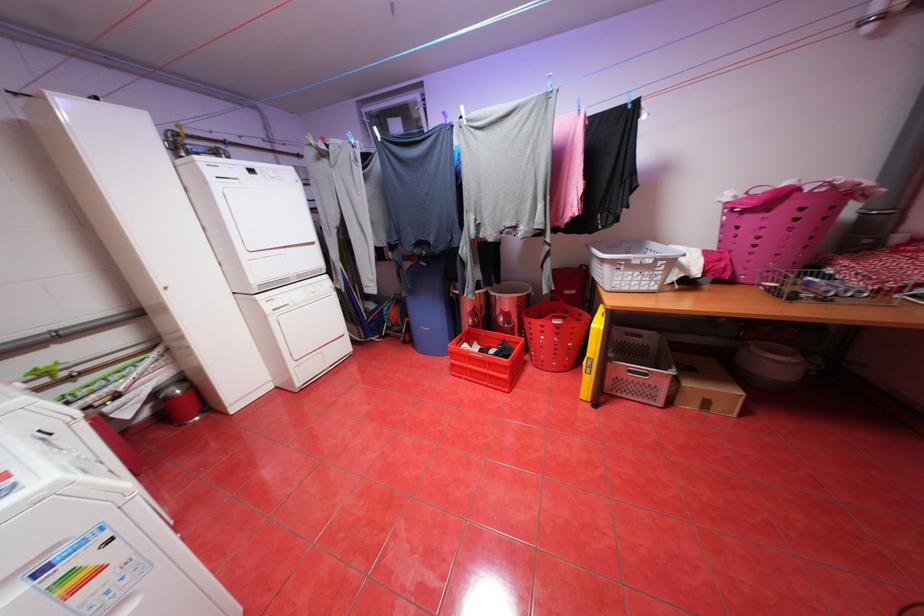
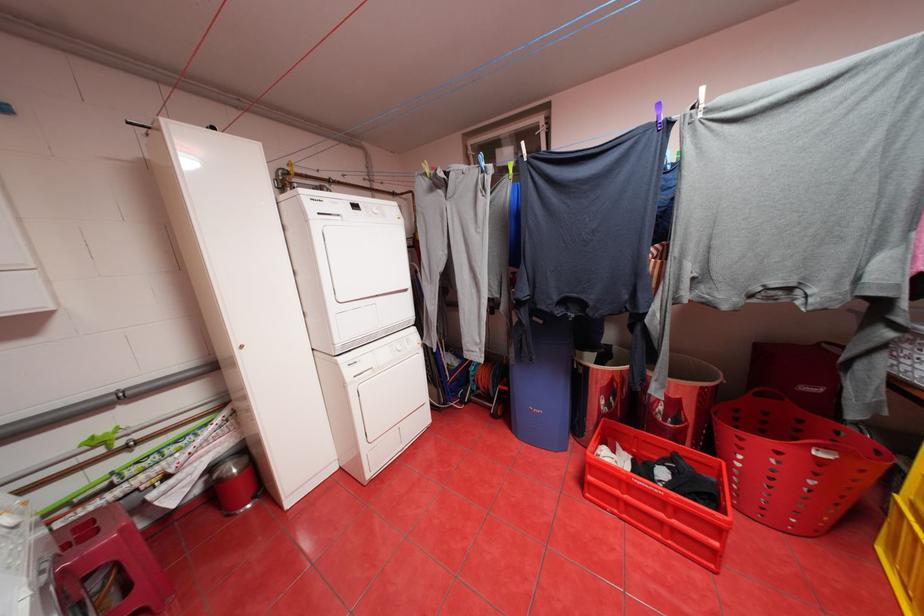
Question: The first image is from the beginning of the video and the second image is from the end. How did the camera likely rotate when shooting the video?

Choices:
 (A) Left
 (B) Right
 (C) Up
 (D) Down

Answer: (A)